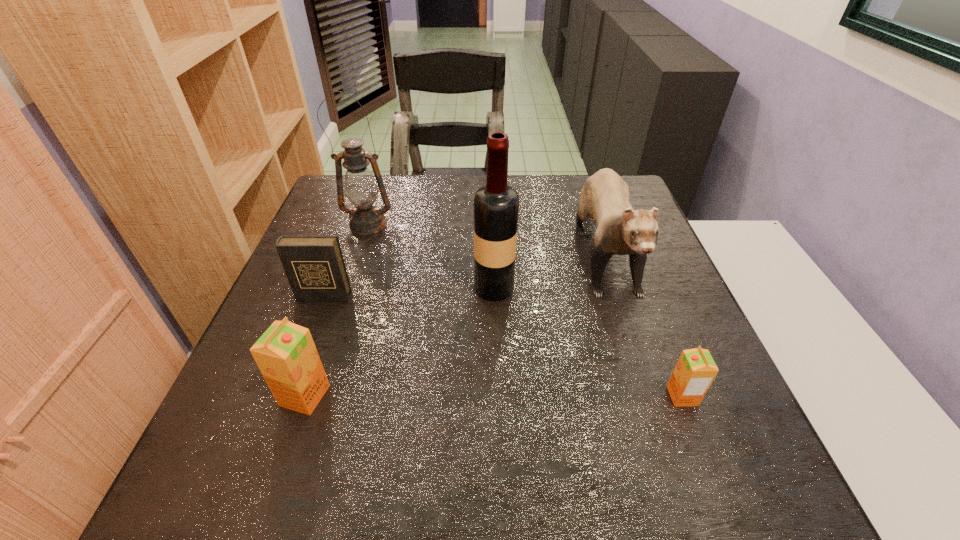
The height and width of the screenshot is (540, 960). I want to click on vacant point located between the third object from right to left and the diary, so 409,292.

You are a GUI agent. You are given a task and a screenshot of the screen. Output one action in this format:
    pyautogui.click(x=<x>, y=<y>)
    Task: Click on the free spot between the oil lamp and the shorter orange juice
    Image resolution: width=960 pixels, height=540 pixels.
    Given the screenshot: What is the action you would take?
    pyautogui.click(x=525, y=310)

The height and width of the screenshot is (540, 960). Find the location of `free space between the third tallest object and the shorter orange juice`. free space between the third tallest object and the shorter orange juice is located at coordinates (642, 320).

The image size is (960, 540). I want to click on vacant point located between the oil lamp and the right orange juice, so click(x=525, y=310).

The height and width of the screenshot is (540, 960). In order to click on vacant area that lies between the taller orange juice and the wine bottle in this screenshot , I will do pos(399,342).

This screenshot has width=960, height=540. I want to click on vacant space that's between the wine bottle and the shorter orange juice, so click(x=588, y=342).

Find the location of a particular element. vacant point located between the shorter orange juice and the oil lamp is located at coordinates [525, 310].

Identify the location of free space between the third object from right to left and the fifth tallest object. This screenshot has height=540, width=960. (409, 292).

This screenshot has height=540, width=960. What are the coordinates of `free point between the left orange juice and the oil lamp` in the screenshot? It's located at (337, 310).

You are a GUI agent. You are given a task and a screenshot of the screen. Output one action in this format:
    pyautogui.click(x=<x>, y=<y>)
    Task: Click on the free spot between the diary and the shorter orange juice
    
    Given the screenshot: What is the action you would take?
    pyautogui.click(x=503, y=346)